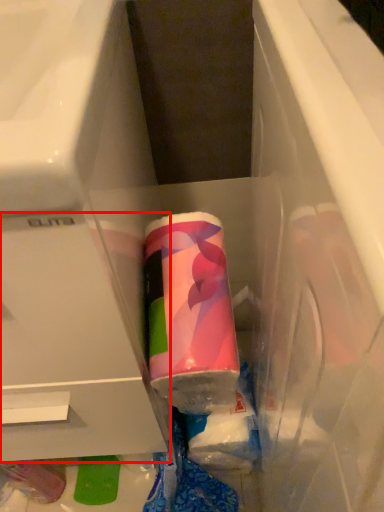
Question: From the image's perspective, what is the correct spatial positioning of drawer (annotated by the red box) in reference to toothpaste?

Choices:
 (A) below
 (B) above

Answer: (B)